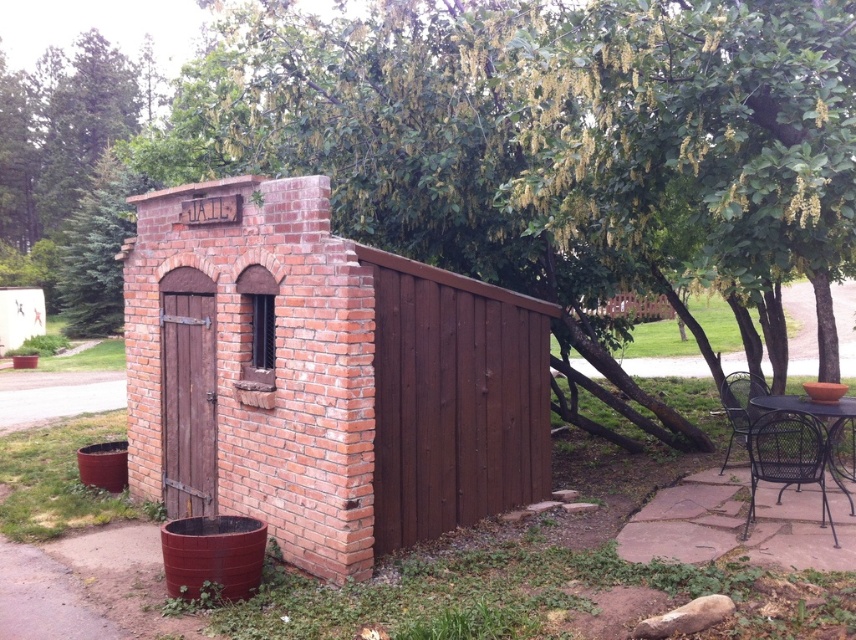
You are setting up a picnic area near the brick textured hut at center and the black wicker table at lower right. Considering their sizes, which object would be more suitable to place a large picnic basket on?

The brick textured hut at center is larger in size than the black wicker table at lower right, so the brick textured hut at center can accommodate the large picnic basket more appropriately.

Looking at this image, you are a visitor at this miniature jailhouse and want to sit down. You see a rustic wicker chair at lower right and a black wicker table at lower right. Which object is closer to you?

The rustic wicker chair at lower right is closer to you because the black wicker table at lower right is behind it.

In the scene shown: You are standing at the point marked as point (322, 376) in the image. What structure are you facing directly?

The point (322, 376) corresponds to the brick textured hut at center, so you are facing the brick textured hut at center directly.